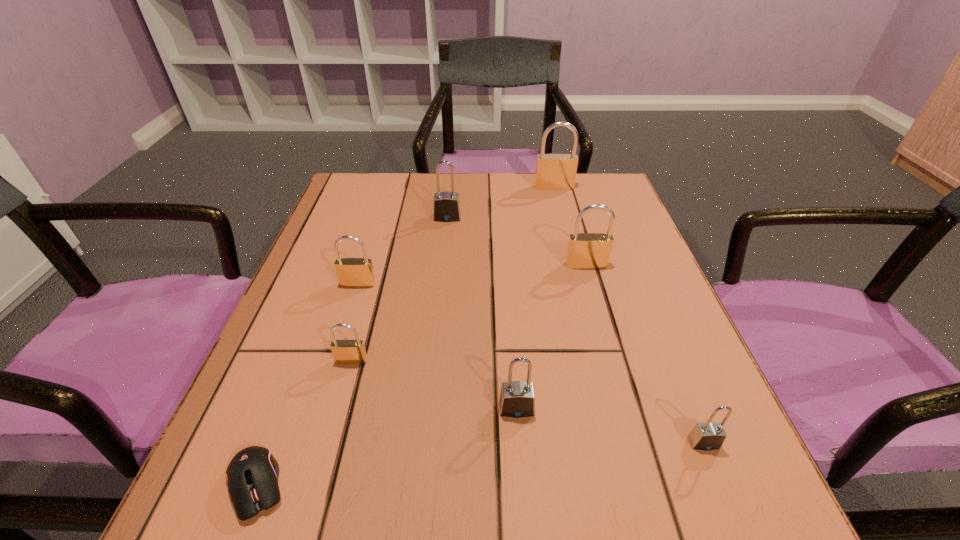
The width and height of the screenshot is (960, 540). I want to click on vacant point located on the front-facing side of the second nearest brass padlock, so click(305, 455).

The width and height of the screenshot is (960, 540). Find the location of `vacant space situated on the front-facing side of the smallest brass padlock`. vacant space situated on the front-facing side of the smallest brass padlock is located at coordinates (336, 418).

The height and width of the screenshot is (540, 960). I want to click on vacant region located 0.290m on the right of the nearest object, so click(x=505, y=485).

Find the location of a particular element. The height and width of the screenshot is (540, 960). object that is at the near edge is located at coordinates (252, 475).

Where is `computer mouse present at the left edge`? This screenshot has width=960, height=540. computer mouse present at the left edge is located at coordinates (252, 475).

Image resolution: width=960 pixels, height=540 pixels. I want to click on object present at the near left corner, so click(x=252, y=475).

The image size is (960, 540). In order to click on object present at the far right corner in this screenshot , I will do `click(553, 171)`.

In the image, there is a desktop. Identify the location of blank space at the far edge. The width and height of the screenshot is (960, 540). (509, 212).

Locate an element on the screen. The height and width of the screenshot is (540, 960). vacant space at the near edge is located at coordinates (481, 505).

Where is `vacant space at the left edge of the desktop`? The image size is (960, 540). vacant space at the left edge of the desktop is located at coordinates (355, 318).